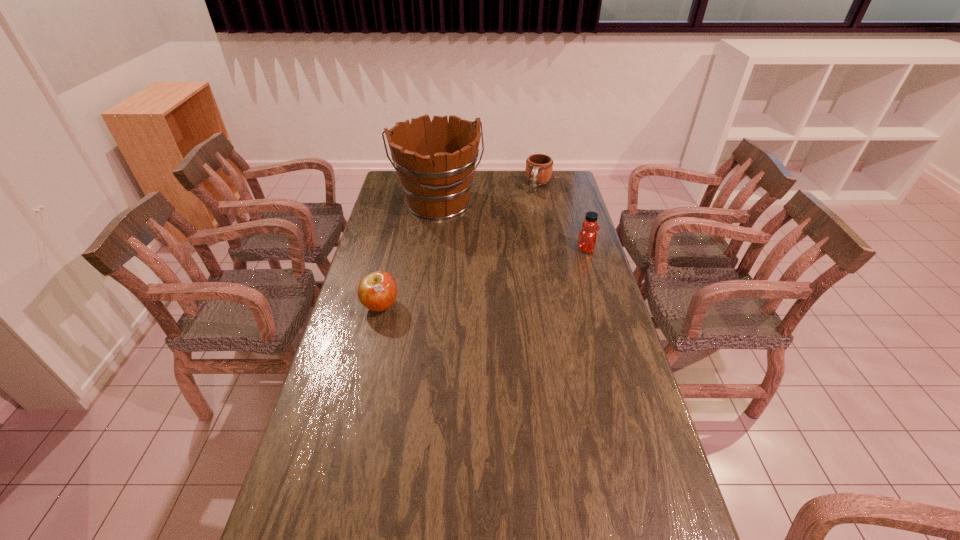
You are a GUI agent. You are given a task and a screenshot of the screen. Output one action in this format:
    pyautogui.click(x=<x>, y=<y>)
    Task: Click on the nearest object
    This screenshot has height=540, width=960.
    Given the screenshot: What is the action you would take?
    pyautogui.click(x=377, y=291)

In order to click on the second nearest object in this screenshot , I will do (587, 238).

Find the location of a particular element. The height and width of the screenshot is (540, 960). the third shortest object is located at coordinates (587, 238).

The image size is (960, 540). What are the coordinates of `the tallest object` in the screenshot? It's located at (435, 161).

This screenshot has width=960, height=540. I want to click on the second object from right to left, so click(539, 167).

Find the location of a particular element. Image resolution: width=960 pixels, height=540 pixels. blank area located on the back of the nearest object is located at coordinates (395, 248).

Identify the location of vacant region located with the handle on the wine bucket. pos(456,249).

You are a GUI agent. You are given a task and a screenshot of the screen. Output one action in this format:
    pyautogui.click(x=<x>, y=<y>)
    Task: Click on the free point located with the handle on the wine bucket
    
    Given the screenshot: What is the action you would take?
    pyautogui.click(x=456, y=251)

This screenshot has height=540, width=960. Find the location of `vacant area situated 0.070m with the handle on the wine bucket`. vacant area situated 0.070m with the handle on the wine bucket is located at coordinates (451, 237).

Image resolution: width=960 pixels, height=540 pixels. I want to click on free space located 0.370m on the side of the third object from left to right with the handle, so click(x=518, y=239).